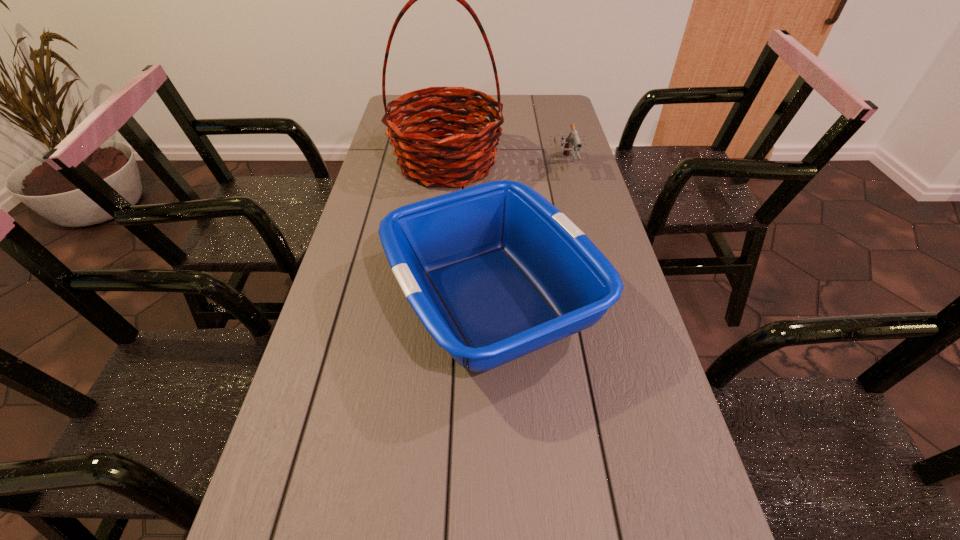
Identify the location of object that stands as the second closest to the shortest object. Image resolution: width=960 pixels, height=540 pixels. (494, 272).

This screenshot has height=540, width=960. Find the location of `free space that satisfies the following two spatial constraints: 1. on the front side of the second tallest object; 2. on the left side of the basket`. free space that satisfies the following two spatial constraints: 1. on the front side of the second tallest object; 2. on the left side of the basket is located at coordinates (433, 300).